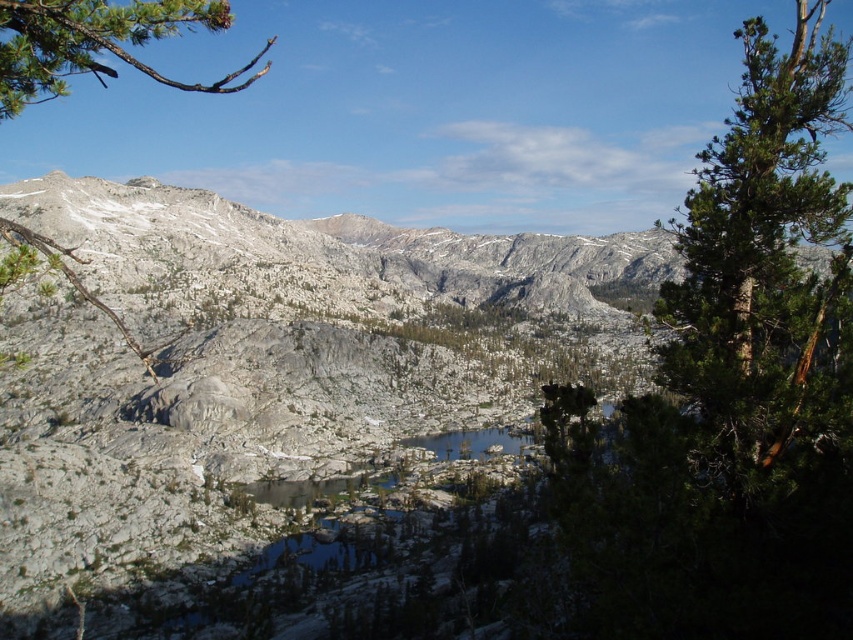
From the picture: Is the position of gray rocky mountain at center more distant than that of green needle-like branch at upper left?

No, it is not.

Based on the photo, who is more distant from viewer, (206, 532) or (30, 10)?

The point (206, 532) is more distant.

At what (x,y) coordinates should I click in order to perform the action: click on gray rocky mountain at center. Please return your answer as a coordinate pair (x, y). The width and height of the screenshot is (853, 640). Looking at the image, I should click on (410, 419).

From the picture: Is gray rocky mountain at center further to camera compared to green textured tree at right?

No, gray rocky mountain at center is closer to the viewer.

At what (x,y) coordinates should I click in order to perform the action: click on gray rocky mountain at center. Please return your answer as a coordinate pair (x, y). Image resolution: width=853 pixels, height=640 pixels. Looking at the image, I should click on (410, 419).

Identify the location of gray rocky mountain at center. This screenshot has height=640, width=853. (410, 419).

Does green textured tree at right have a lesser height compared to green needle-like branch at upper left?

No.

Identify the location of green textured tree at right. (761, 257).